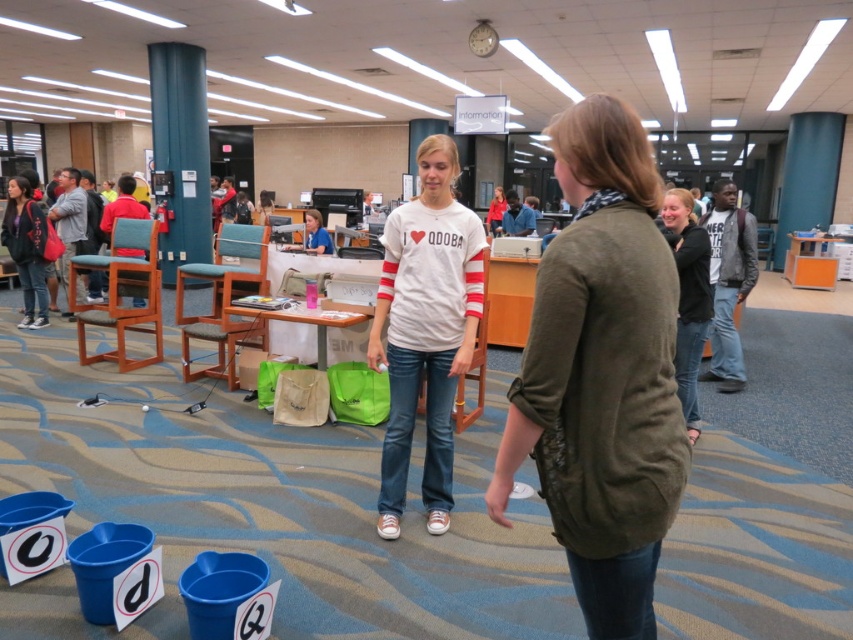
You are standing in the library and want to reach a point that is exactly 9.10 feet away from you. Can you identify the point labeled as point (393,260) in the scene?

Yes, the point labeled as point (393,260) is exactly 9.10 feet away from the viewer, so you can identify it as the point you want to reach.